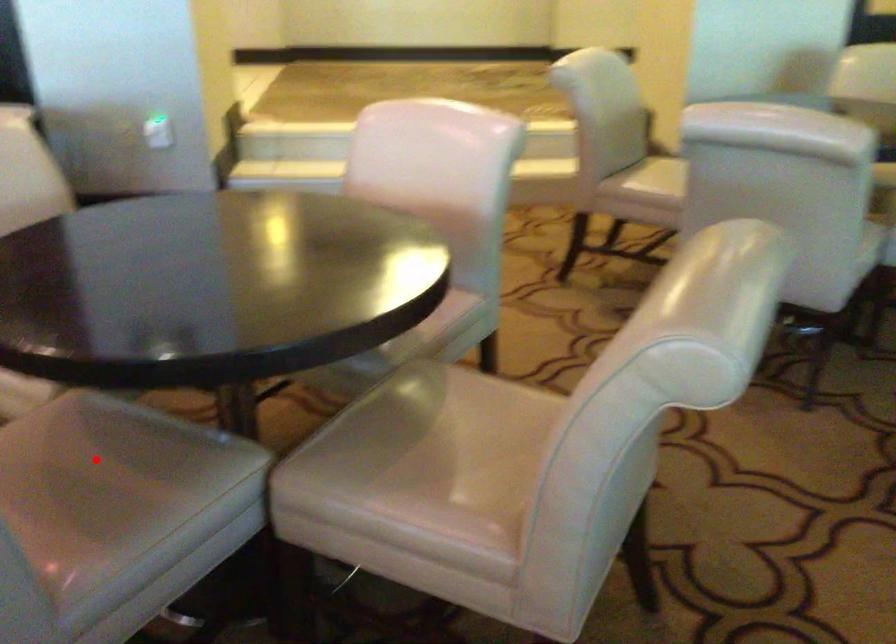
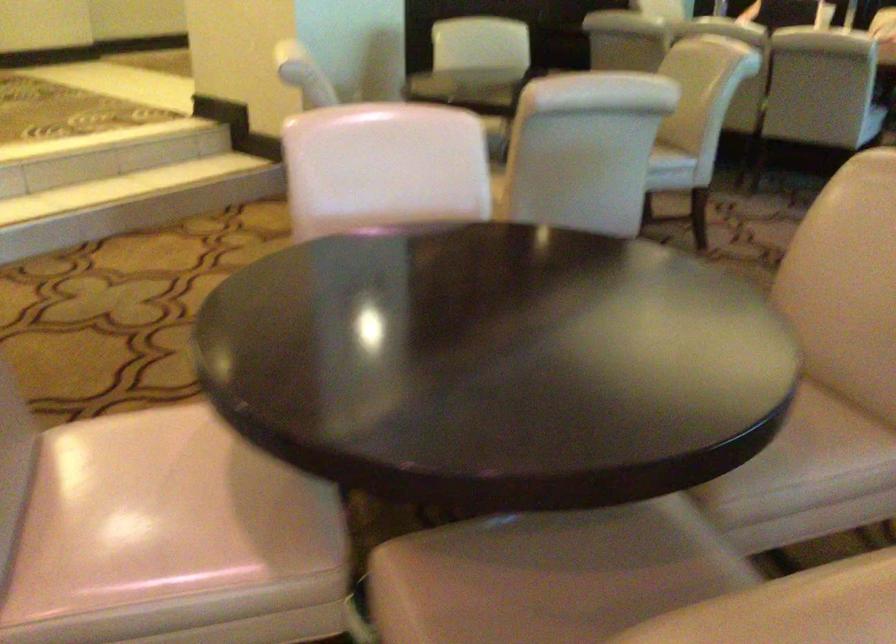
Question: I am providing you with two images of the same scene from different viewpoints. In image1, a red point is highlighted. Considering the same 3D point in image2, which of the following is correct?

Choices:
 (A) It is closer
 (B) It is farther

Answer: (A)